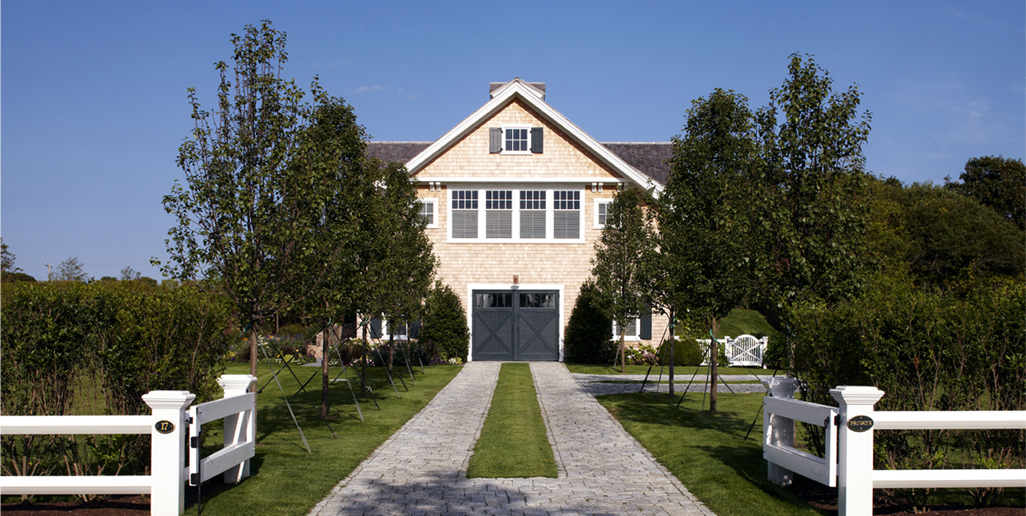
Where is `brick wall`? This screenshot has height=516, width=1026. brick wall is located at coordinates (469, 259).